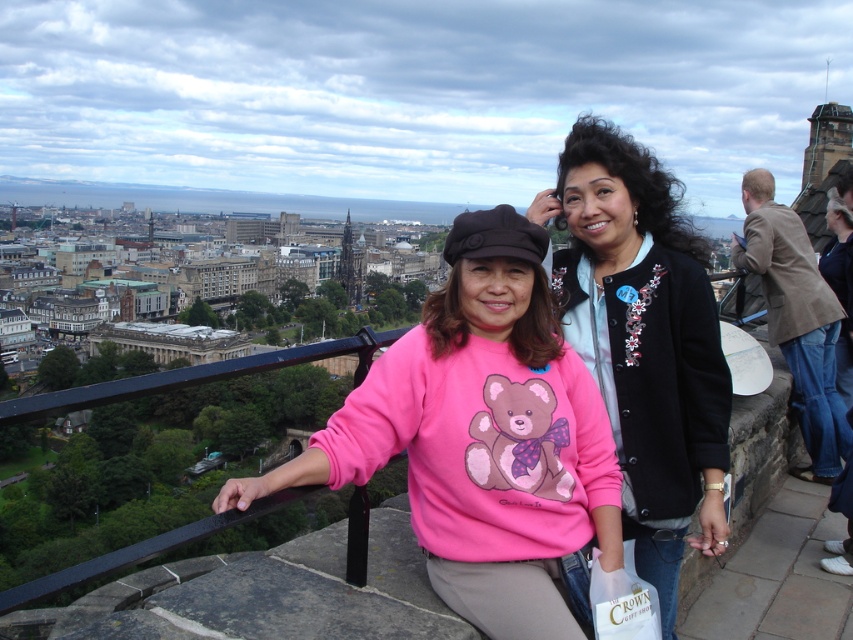
Does pink fleece sweater at center have a lesser height compared to brown leather jacket at upper right?

Yes.

Does pink fleece sweater at center lie behind brown leather jacket at upper right?

No, pink fleece sweater at center is in front of brown leather jacket at upper right.

The image size is (853, 640). What do you see at coordinates (480, 436) in the screenshot?
I see `pink fleece sweater at center` at bounding box center [480, 436].

I want to click on pink fleece sweater at center, so click(x=480, y=436).

Is black matte jacket at center smaller than brown leather jacket at upper right?

Correct, black matte jacket at center occupies less space than brown leather jacket at upper right.

Who is positioned more to the right, black matte jacket at center or brown leather jacket at upper right?

brown leather jacket at upper right

What do you see at coordinates (643, 340) in the screenshot? Image resolution: width=853 pixels, height=640 pixels. I see `black matte jacket at center` at bounding box center [643, 340].

Where is `black matte jacket at center`? black matte jacket at center is located at coordinates (643, 340).

Is pink fleece sweater at center smaller than black matte jacket at center?

No.

Does pink fleece sweater at center appear over black matte jacket at center?

Actually, pink fleece sweater at center is below black matte jacket at center.

Between point (360, 467) and point (635, 204), which one is positioned in front?

Positioned in front is point (360, 467).

In order to click on pink fleece sweater at center in this screenshot , I will do `click(480, 436)`.